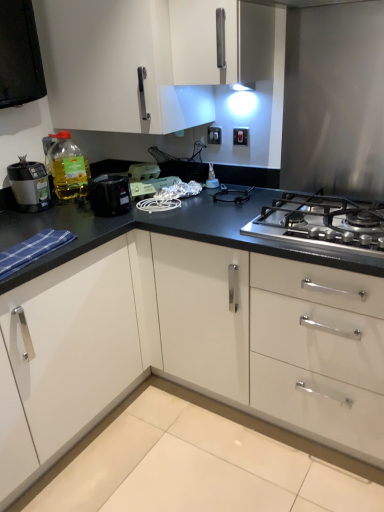
Question: Can you confirm if stainless steel gas stove at center is taller than white plastic electric outlet at upper center, marked as the second electric outlet in a left-to-right arrangement?

Choices:
 (A) no
 (B) yes

Answer: (B)

Question: Is stainless steel gas stove at center positioned behind white plastic electric outlet at upper center, the first electric outlet positioned from the right?

Choices:
 (A) yes
 (B) no

Answer: (B)

Question: Considering the relative positions of stainless steel gas stove at center and white plastic electric outlet at upper center, the first electric outlet positioned from the right, in the image provided, is stainless steel gas stove at center to the left of white plastic electric outlet at upper center, the first electric outlet positioned from the right, from the viewer's perspective?

Choices:
 (A) yes
 (B) no

Answer: (B)

Question: Is stainless steel gas stove at center closer to camera compared to white plastic electric outlet at upper center, which is the first electric outlet from front to back?

Choices:
 (A) yes
 (B) no

Answer: (A)

Question: Is white plastic electric outlet at upper center, positioned as the 2th electric outlet in back-to-front order, a part of stainless steel gas stove at center?

Choices:
 (A) yes
 (B) no

Answer: (B)

Question: Is point (216, 138) positioned closer to the camera than point (244, 134)?

Choices:
 (A) closer
 (B) farther

Answer: (B)

Question: Do you think white plastic electric outlet at upper center, the first electric outlet viewed from the left, is within white plastic electric outlet at upper center, positioned as the 2th electric outlet in back-to-front order, or outside of it?

Choices:
 (A) inside
 (B) outside

Answer: (B)

Question: In terms of width, does white plastic electric outlet at upper center, which is the 2th electric outlet in right-to-left order, look wider or thinner when compared to white plastic electric outlet at upper center, positioned as the 2th electric outlet in back-to-front order?

Choices:
 (A) thin
 (B) wide

Answer: (A)

Question: Visually, is white plastic electric outlet at upper center, the first electric outlet viewed from the left, positioned to the left or to the right of white plastic electric outlet at upper center, marked as the second electric outlet in a left-to-right arrangement?

Choices:
 (A) left
 (B) right

Answer: (A)

Question: Considering the relative positions of white glossy cabinet at upper center and matte black blender at left, the 1th kitchen appliance in the left-to-right sequence, in the image provided, is white glossy cabinet at upper center to the left or to the right of matte black blender at left, the 1th kitchen appliance in the left-to-right sequence,?

Choices:
 (A) left
 (B) right

Answer: (B)

Question: Considering the positions of white glossy cabinet at upper center and matte black blender at left, the 1th kitchen appliance in the left-to-right sequence, in the image, is white glossy cabinet at upper center taller or shorter than matte black blender at left, the 1th kitchen appliance in the left-to-right sequence,?

Choices:
 (A) tall
 (B) short

Answer: (A)

Question: From a real-world perspective, is white glossy cabinet at upper center physically located above or below matte black blender at left, acting as the second kitchen appliance starting from the right?

Choices:
 (A) above
 (B) below

Answer: (A)

Question: Based on their sizes in the image, would you say white glossy cabinet at upper center is bigger or smaller than matte black blender at left, the 1th kitchen appliance in the left-to-right sequence?

Choices:
 (A) big
 (B) small

Answer: (A)

Question: From a real-world perspective, is translucent yellow bottle at left physically located above or below white plastic electric outlet at upper center, which is the 2th electric outlet in right-to-left order?

Choices:
 (A) below
 (B) above

Answer: (A)

Question: In terms of width, does translucent yellow bottle at left look wider or thinner when compared to white plastic electric outlet at upper center, which ranks as the 1th electric outlet in back-to-front order?

Choices:
 (A) thin
 (B) wide

Answer: (B)